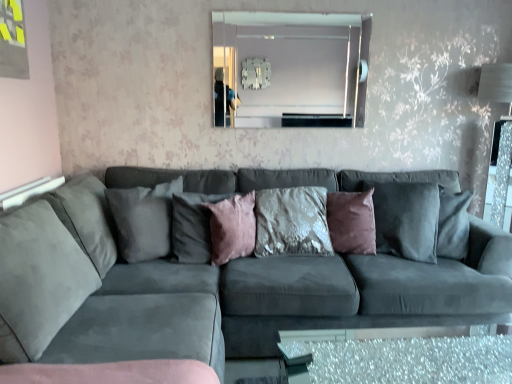
In order to click on free space above clear glass mirror at upper center (from a real-world perspective) in this screenshot , I will do `click(287, 5)`.